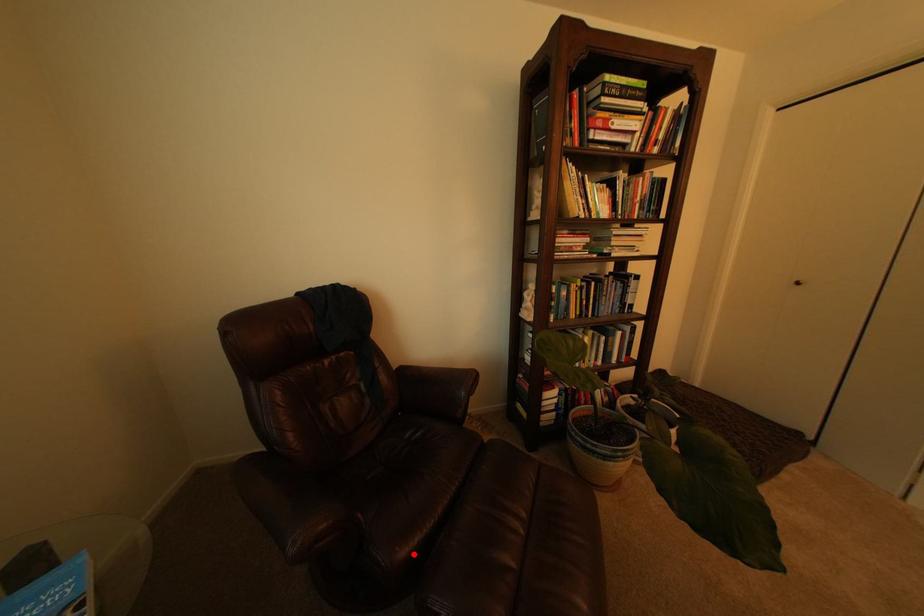
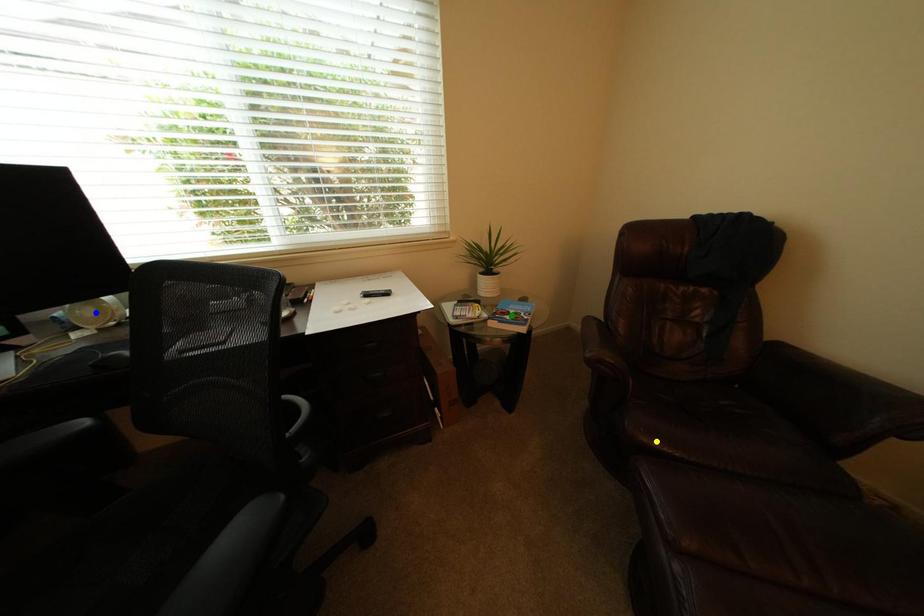
Question: I am providing you with two images of the same scene from different viewpoints. A red point is marked on the first image. You are given multiple points on the second image. Which point in image 2 represents the same 3d spot as the red point in image 1?

Choices:
 (A) yellow point
 (B) green point
 (C) blue point

Answer: (A)